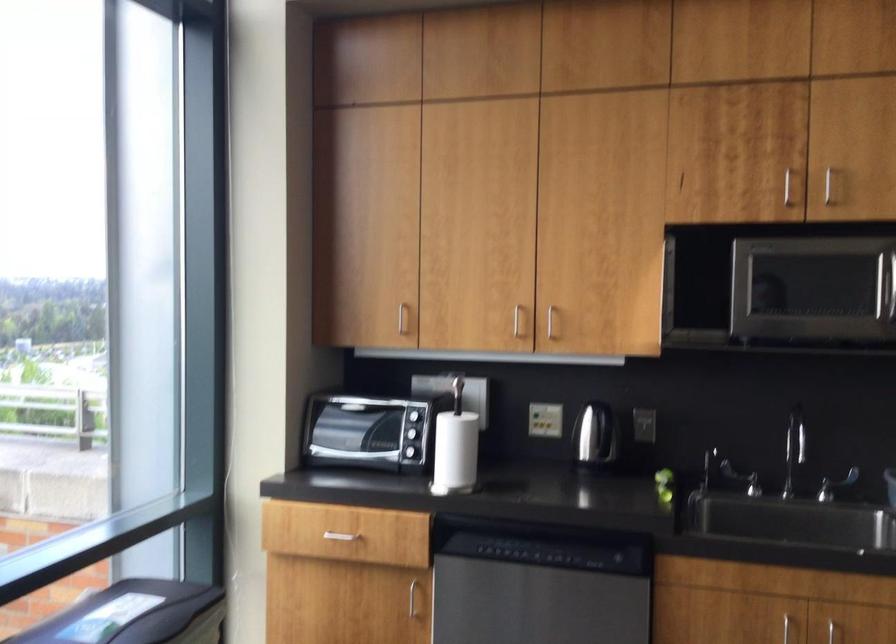
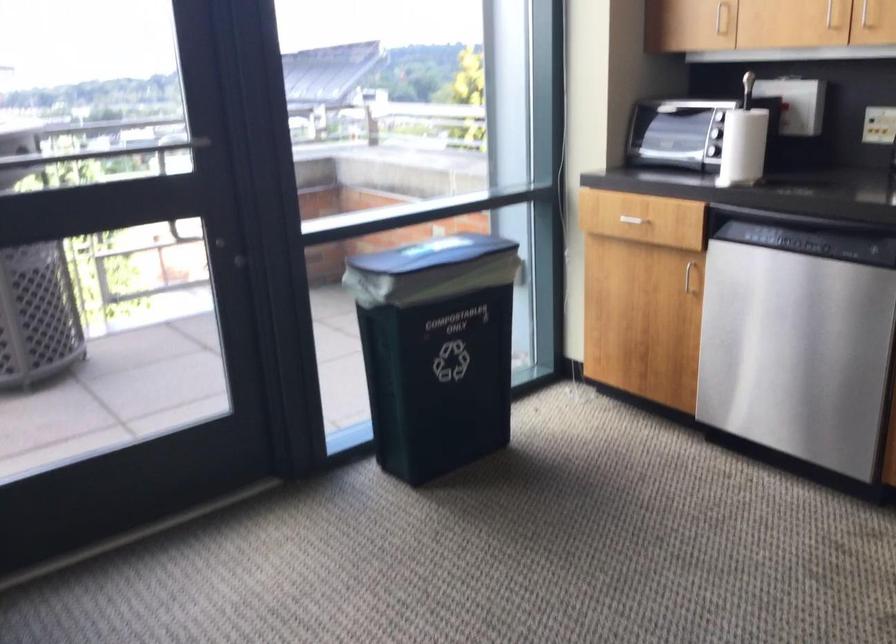
The point at (407, 322) is marked in the first image. Where is the corresponding point in the second image?

(721, 17)